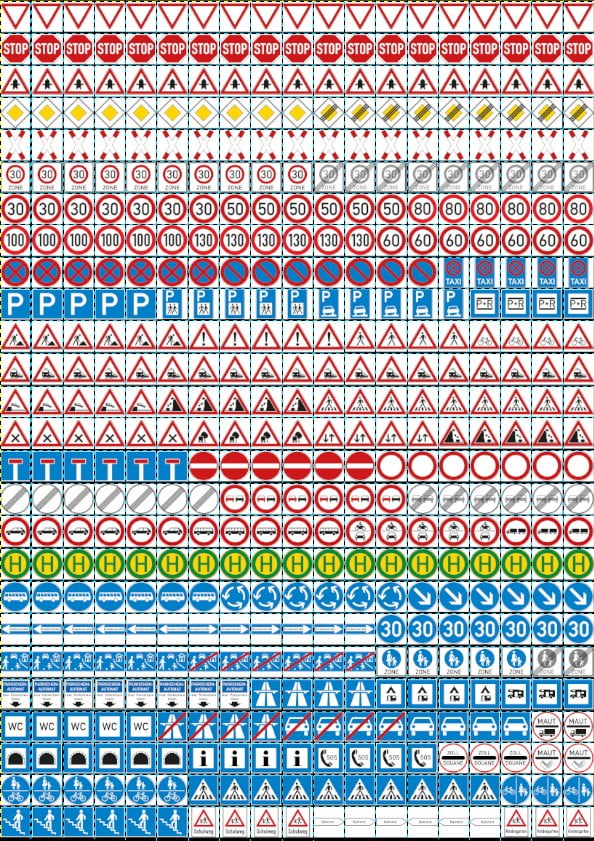
The image size is (594, 841). I want to click on wc, so point(145,730), point(115,722), point(80,725), point(48,725), point(10,723).